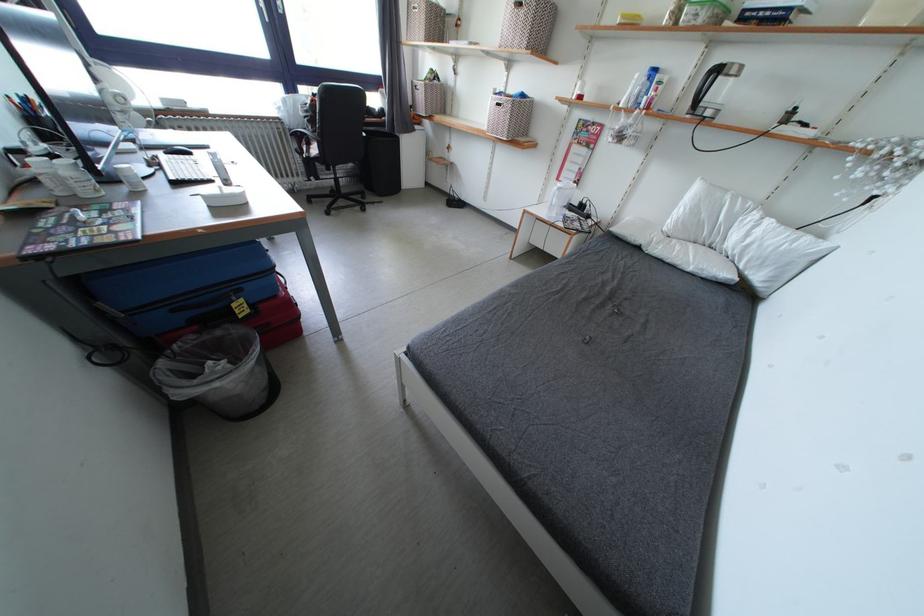
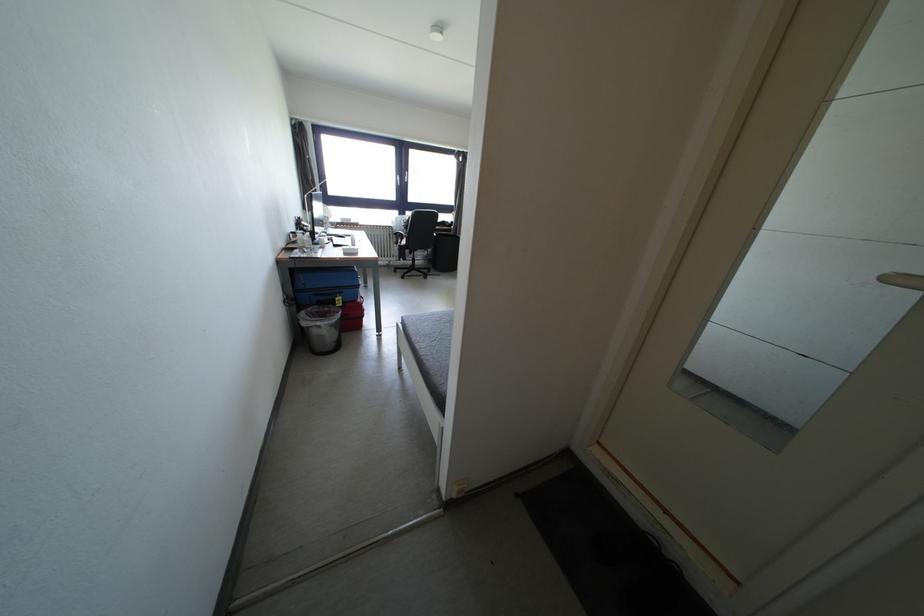
Where in the second image is the point corresponding to (293,127) from the first image?

(400, 233)